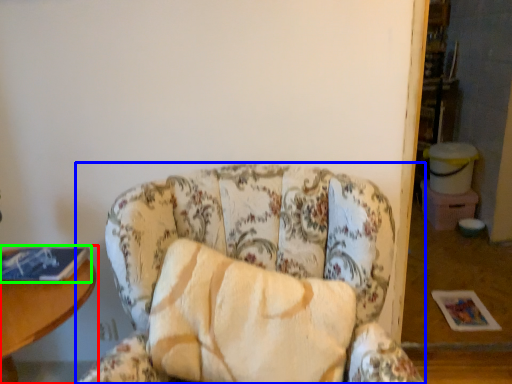
Question: Based on their relative distances, which object is nearer to table (highlighted by a red box)? Choose from chair (highlighted by a blue box) and book (highlighted by a green box).

Choices:
 (A) chair
 (B) book

Answer: (B)